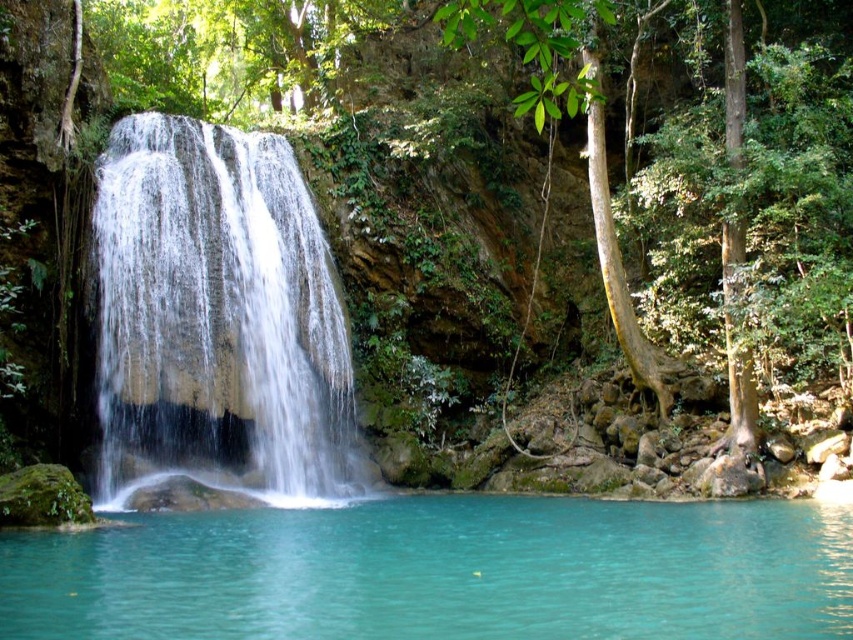
Based on the photo, can you confirm if turquoise liquid at center is positioned to the left of white smooth waterfall at center?

No, turquoise liquid at center is not to the left of white smooth waterfall at center.

Between point (469, 557) and point (144, 176), which one is positioned in front?

Positioned in front is point (469, 557).

Does point (525, 556) lie behind point (276, 141)?

That is False.

Locate an element on the screen. This screenshot has height=640, width=853. turquoise liquid at center is located at coordinates (442, 572).